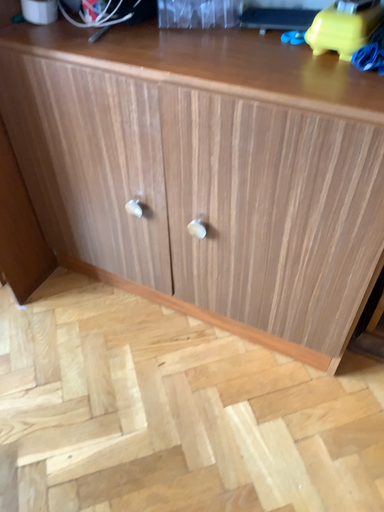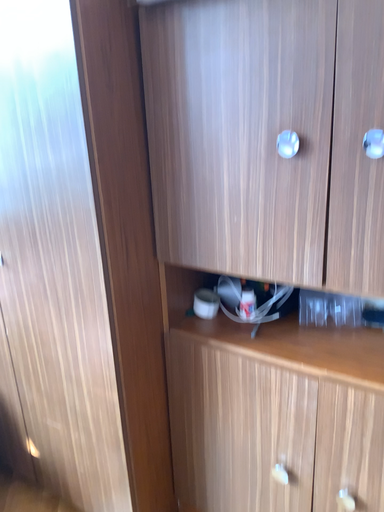
Question: Which way did the camera rotate in the video?

Choices:
 (A) rotated downward
 (B) rotated upward

Answer: (B)